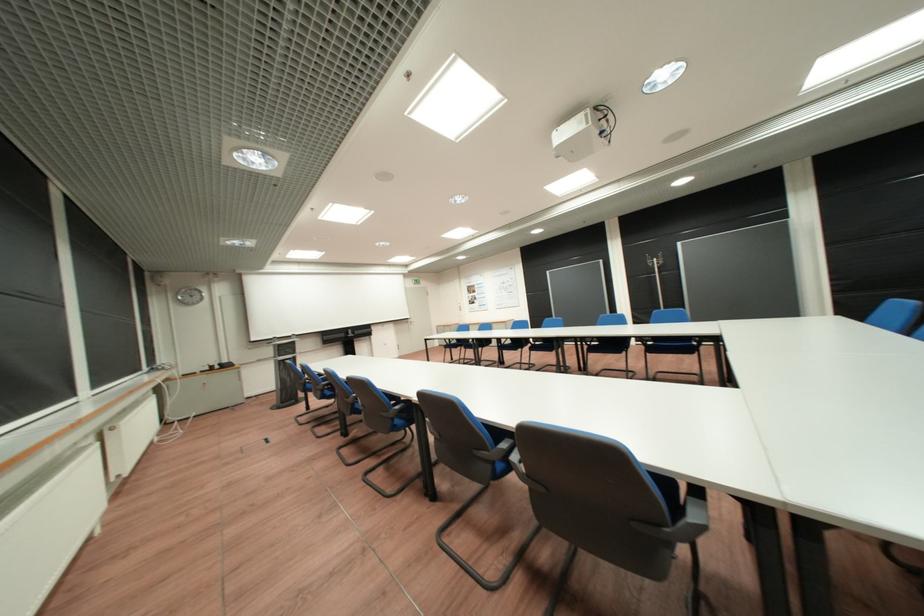
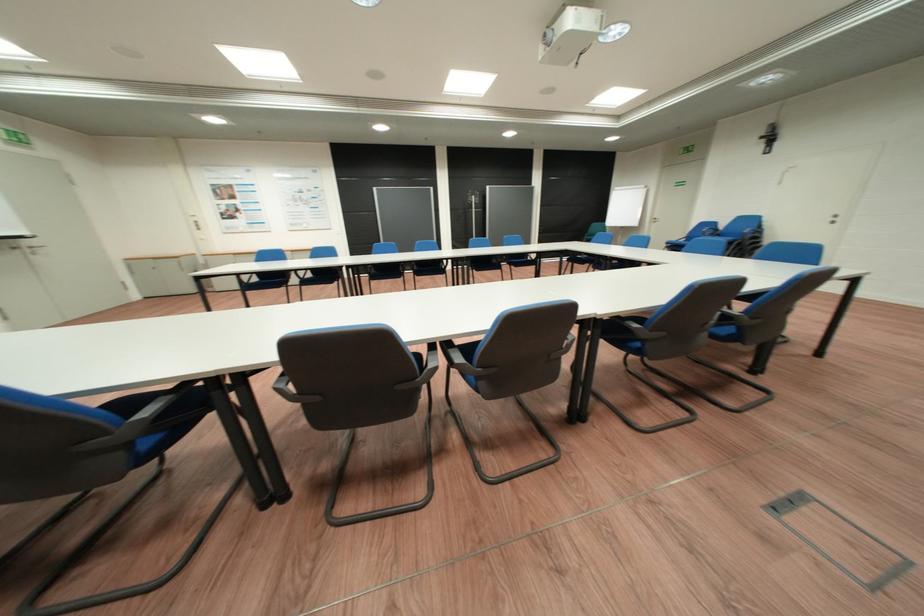
The point at (491, 330) is marked in the first image. Where is the corresponding point in the second image?

(322, 254)